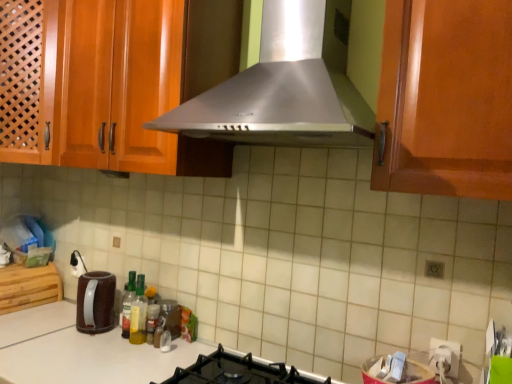
Question: Considering the positions of point (123, 337) and point (111, 317), is point (123, 337) closer or farther from the camera than point (111, 317)?

Choices:
 (A) closer
 (B) farther

Answer: (A)

Question: From the image's perspective, is translucent glass bottle at center, the 1th bottle from the left, above or below brown matte electric kettle at lower left?

Choices:
 (A) below
 (B) above

Answer: (B)

Question: Which of these objects is positioned farthest from the translucent plastic bottle at center, arranged as the second bottle when viewed from the right?

Choices:
 (A) wooden cutting board at lower left
 (B) metallic glass jar at center
 (C) translucent glass bottle at center, the 1th bottle from the left
 (D) black matte gas stove at lower center
 (E) translucent plastic bottle at center, the 1th bottle when ordered from right to left

Answer: (A)

Question: Which object is positioned closest to the translucent glass bottle at center, the 1th bottle from the left?

Choices:
 (A) wooden cutting board at lower left
 (B) translucent plastic bottle at center, the 3th bottle in the left-to-right sequence
 (C) metallic glass jar at center
 (D) brown matte electric kettle at lower left
 (E) translucent plastic bottle at center, arranged as the second bottle when viewed from the right

Answer: (E)